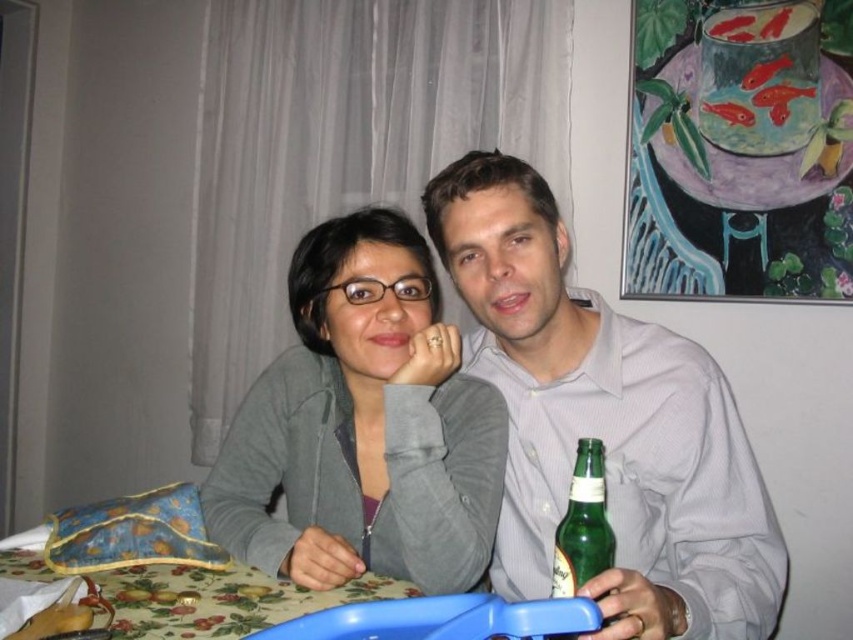
Who is higher up, gray cotton shirt at center or green glass bottle at right?

gray cotton shirt at center is above.

Can you confirm if gray cotton shirt at center is bigger than green glass bottle at right?

Yes, gray cotton shirt at center is bigger than green glass bottle at right.

The image size is (853, 640). Describe the element at coordinates (604, 422) in the screenshot. I see `gray cotton shirt at center` at that location.

This screenshot has height=640, width=853. What are the coordinates of `gray cotton shirt at center` in the screenshot? It's located at (604, 422).

Which is in front, point (370, 600) or point (561, 554)?

Positioned in front is point (561, 554).

Who is more distant from viewer, [113,577] or [601,502]?

The point [113,577] is behind.

Where is `floral fabric table at lower center`? The image size is (853, 640). floral fabric table at lower center is located at coordinates (219, 600).

Looking at this image, who is positioned more to the right, gray cotton shirt at center or floral fabric table at lower center?

gray cotton shirt at center is more to the right.

Between point (485, 300) and point (202, 577), which one is positioned in front?

Point (202, 577)

Between point (538, 560) and point (132, 621), which one is positioned behind?

The point (538, 560) is more distant.

Where is `gray cotton shirt at center`? This screenshot has height=640, width=853. gray cotton shirt at center is located at coordinates (604, 422).